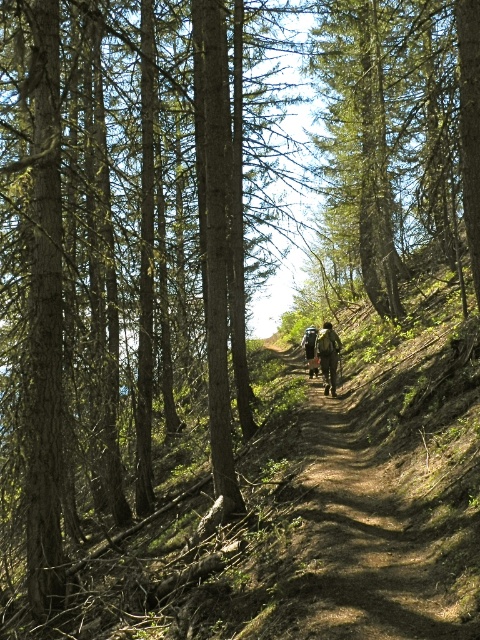
You are a hiker standing at the starting point of the forest trail. You want to reach the end of the trail as quickly as possible. Based on the image, where should you walk to stay on the brown dirt path at center?

The brown dirt path at center is located at coordinates point (359, 545), so you should head towards that position to stay on the path.

You are hiking along the forest trail and notice the brown dirt path at center and the camouflage fabric backpack at center. Which object is nearer to you?

The brown dirt path at center is closer to the viewer than the camouflage fabric backpack at center.